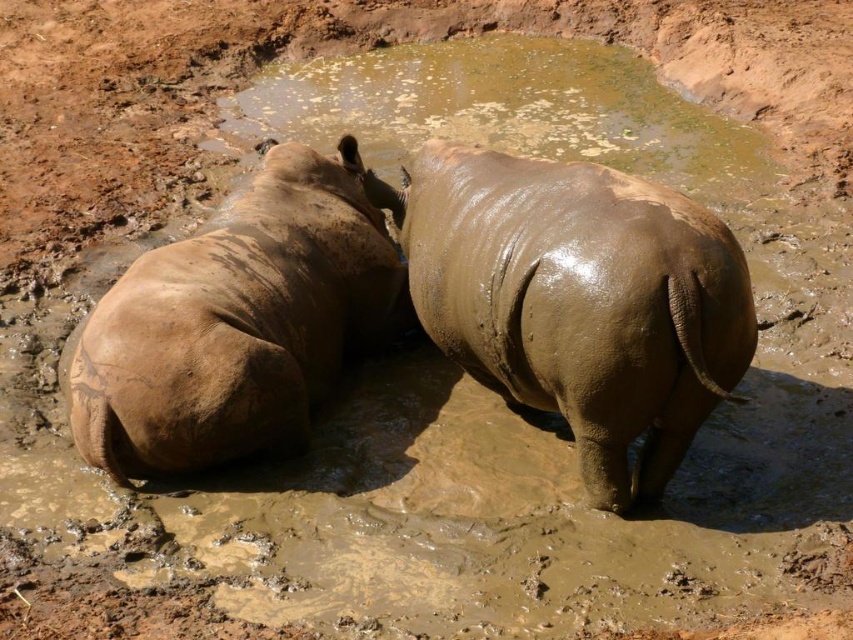
Question: Which point is farther to the camera?

Choices:
 (A) muddy skin rhinoceros at left
 (B) muddy wet rhinoceros at center

Answer: (A)

Question: Which point is closer to the camera taking this photo?

Choices:
 (A) (245, 241)
 (B) (489, 248)

Answer: (B)

Question: Does muddy wet rhinoceros at center appear over muddy skin rhinoceros at left?

Choices:
 (A) no
 (B) yes

Answer: (A)

Question: Can you confirm if muddy wet rhinoceros at center is positioned to the right of muddy skin rhinoceros at left?

Choices:
 (A) yes
 (B) no

Answer: (A)

Question: Can you confirm if muddy wet rhinoceros at center is bigger than muddy skin rhinoceros at left?

Choices:
 (A) no
 (B) yes

Answer: (B)